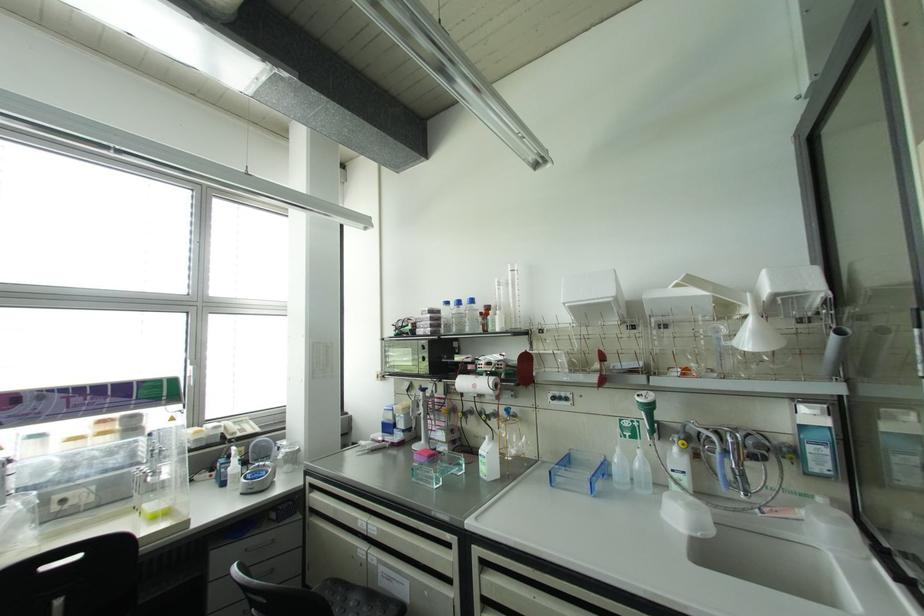
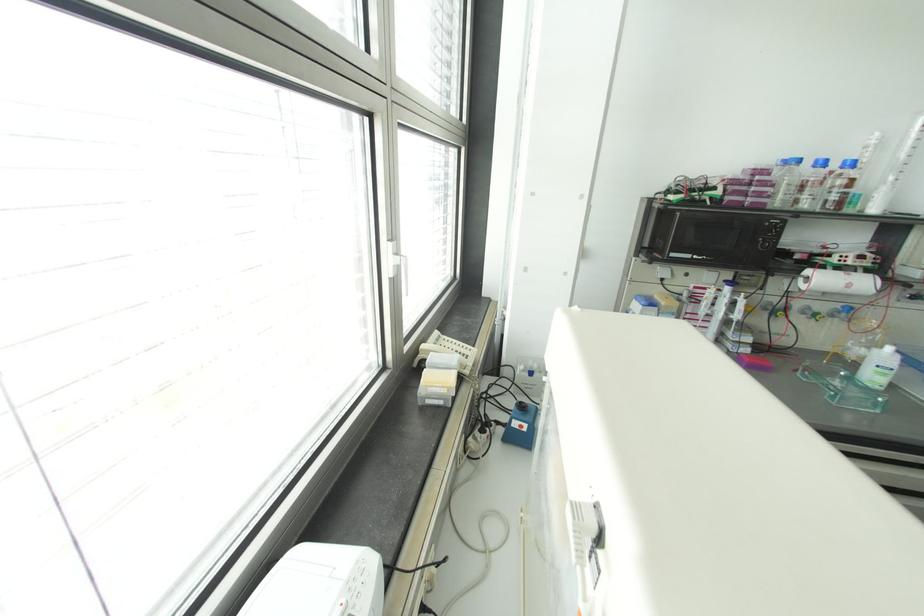
In the second image, find the point that corresponds to (471,301) in the first image.

(852, 163)